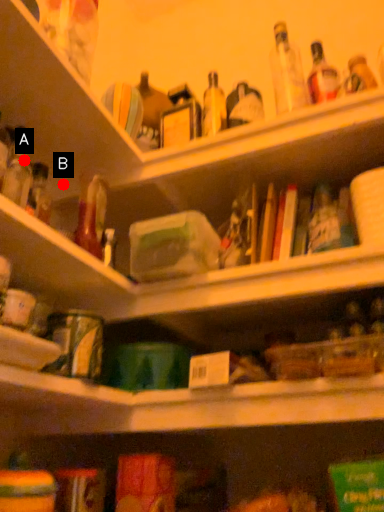
Question: Two points are circled on the image, labeled by A and B beside each circle. Which point is closer to the camera?

Choices:
 (A) A is closer
 (B) B is closer

Answer: (A)